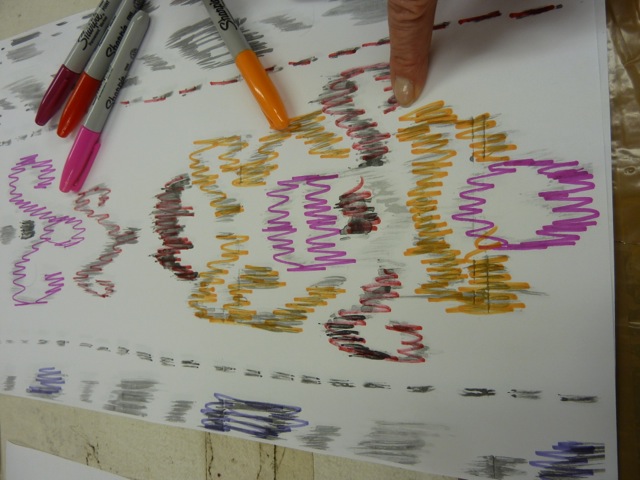
Find the location of a particular element. The width and height of the screenshot is (640, 480). sharpie marker is located at coordinates (70, 71), (80, 83), (97, 109), (236, 41).